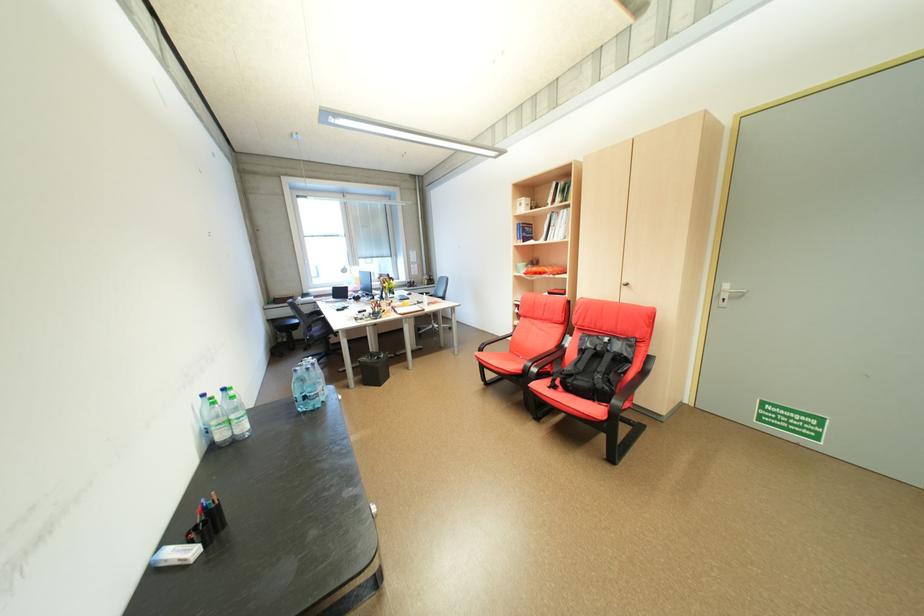
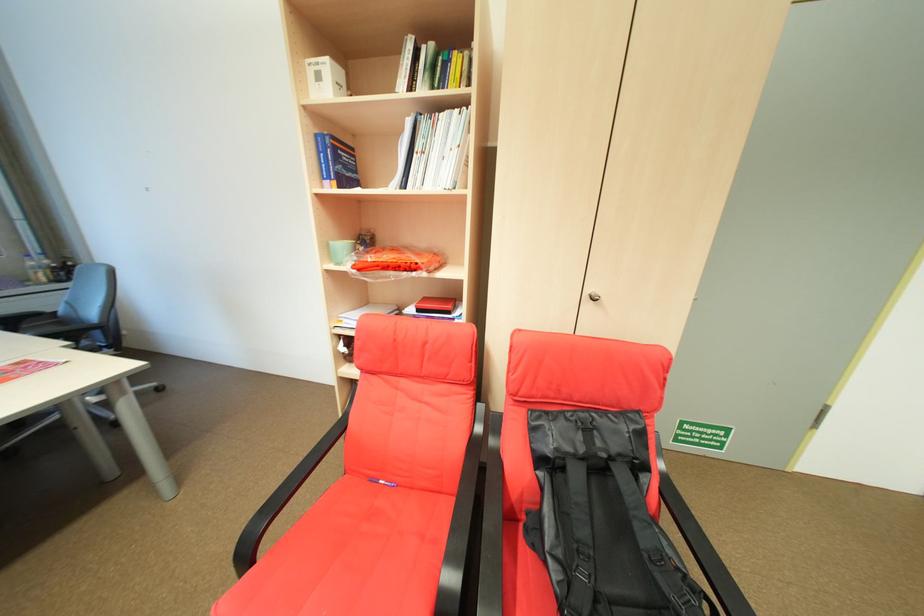
The point at (532, 228) is marked in the first image. Where is the corresponding point in the second image?

(344, 148)